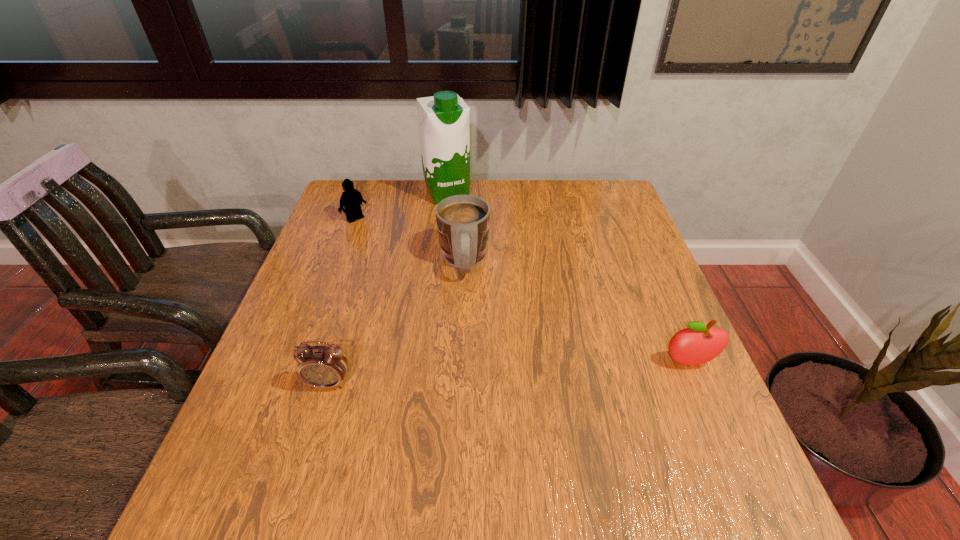
Image resolution: width=960 pixels, height=540 pixels. In order to click on free space between the third nearest object and the fourth nearest object in this screenshot , I will do `click(409, 240)`.

At what (x,y) coordinates should I click in order to perform the action: click on empty space that is in between the nearest object and the second farthest object. Please return your answer as a coordinate pair (x, y). The width and height of the screenshot is (960, 540). Looking at the image, I should click on (342, 301).

I want to click on vacant region between the third nearest object and the Lego, so click(409, 240).

This screenshot has height=540, width=960. Find the location of `free space between the mug and the rightmost object`. free space between the mug and the rightmost object is located at coordinates (576, 312).

Find the location of a particular element. This screenshot has height=540, width=960. blank region between the farthest object and the nearest object is located at coordinates (388, 288).

You are a GUI agent. You are given a task and a screenshot of the screen. Output one action in this format:
    pyautogui.click(x=<x>, y=<y>)
    Task: Click on the free space that is in between the alarm clock and the fourth nearest object
    
    Given the screenshot: What is the action you would take?
    pyautogui.click(x=342, y=301)

You are a GUI agent. You are given a task and a screenshot of the screen. Output one action in this format:
    pyautogui.click(x=<x>, y=<y>)
    Task: Click on the free space between the apple and the alarm clock
    The height and width of the screenshot is (540, 960).
    Given the screenshot: What is the action you would take?
    coord(509,373)

Identify the location of vacant area between the mug and the Lego. The width and height of the screenshot is (960, 540). (409, 240).

At what (x,y) coordinates should I click in order to perform the action: click on empty location between the nearest object and the apple. Please return your answer as a coordinate pair (x, y). Looking at the image, I should click on (509, 373).

Image resolution: width=960 pixels, height=540 pixels. In order to click on free space between the nearest object and the Lego in this screenshot , I will do 342,301.